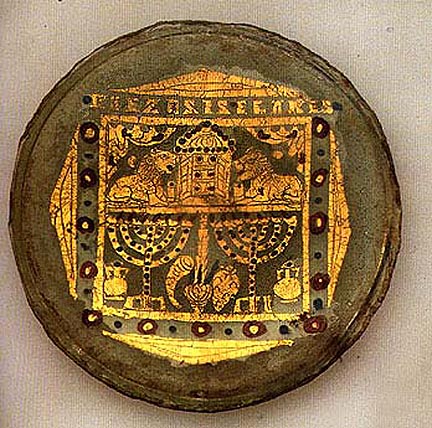
At what (x,y) coordinates should I click in order to perform the action: click on surface. Please return your answer as a coordinate pair (x, y). This screenshot has height=428, width=432. Looking at the image, I should click on (356, 42).